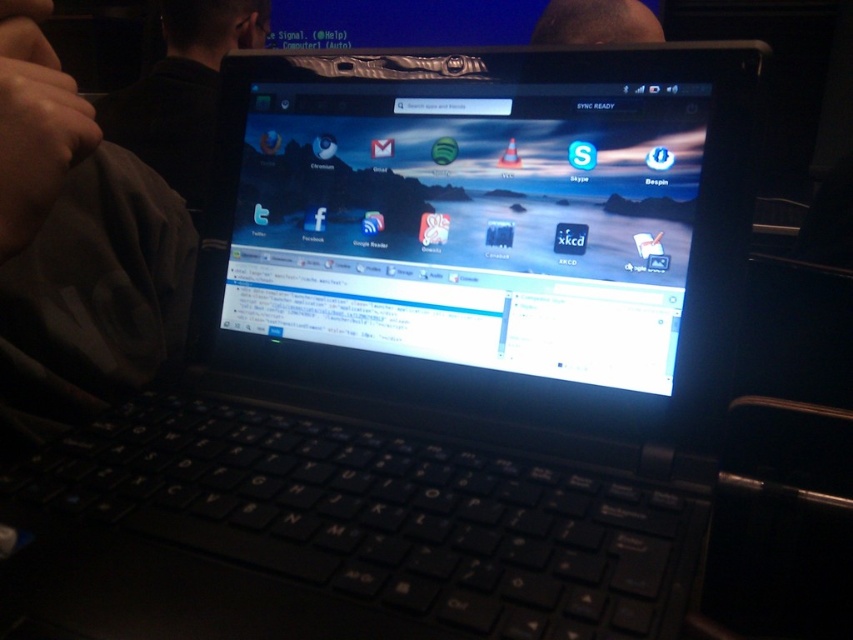
Who is positioned more to the right, dark fabric at lower left or black fabric at upper left?

dark fabric at lower left

Does dark fabric at lower left appear on the left side of black fabric at upper left?

No, dark fabric at lower left is not to the left of black fabric at upper left.

Find the location of a particular element. dark fabric at lower left is located at coordinates (76, 244).

Locate an element on the screen. This screenshot has height=640, width=853. dark fabric at lower left is located at coordinates (76, 244).

Describe the element at coordinates (469, 221) in the screenshot. I see `glossy plastic screen at center` at that location.

Consider the image. Between glossy plastic screen at center and black fabric at upper left, which one has more height?

black fabric at upper left is taller.

Does point (569, 292) come farther from viewer compared to point (239, 1)?

No, it is not.

Locate an element on the screen. glossy plastic screen at center is located at coordinates (469, 221).

I want to click on glossy plastic screen at center, so click(469, 221).